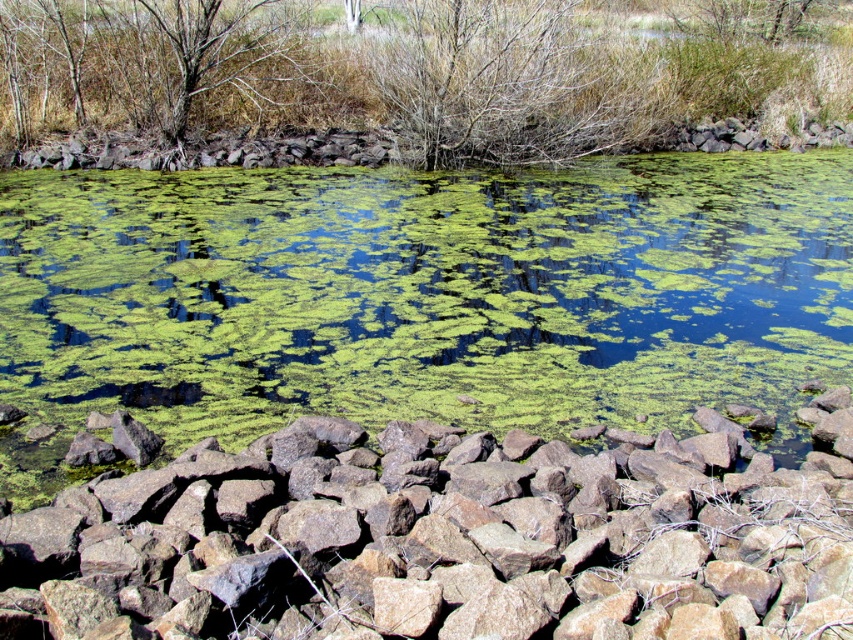
Who is higher up, green algae at center or brown/dry wood tree at upper left?

brown/dry wood tree at upper left is above.

Who is taller, green algae at center or brown/dry wood tree at upper left?

Standing taller between the two is green algae at center.

Which is in front, point (207, 388) or point (202, 42)?

Point (207, 388)

Locate an element on the screen. The height and width of the screenshot is (640, 853). green algae at center is located at coordinates (421, 298).

Between point (15, 486) and point (323, 536), which one is positioned in front?

Point (323, 536) is more forward.

Is green algae at center behind brown rough rock at lower center?

Yes, it is behind brown rough rock at lower center.

This screenshot has height=640, width=853. In order to click on green algae at center in this screenshot , I will do `click(421, 298)`.

Is brown rough rock at lower center above brown/dry wood tree at upper left?

No, brown rough rock at lower center is not above brown/dry wood tree at upper left.

Between point (392, 472) and point (213, 58), which one is positioned behind?

The point (213, 58) is more distant.

Locate an element on the screen. This screenshot has width=853, height=640. brown rough rock at lower center is located at coordinates (434, 544).